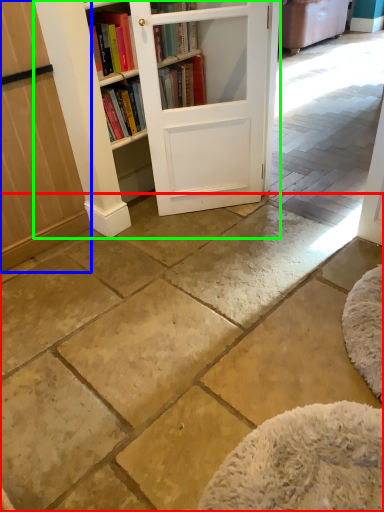
Question: Considering the real-world distances, which object is farthest from concrete (highlighted by a red box)? screen door (highlighted by a blue box) or bookcase (highlighted by a green box)?

Choices:
 (A) screen door
 (B) bookcase

Answer: (B)